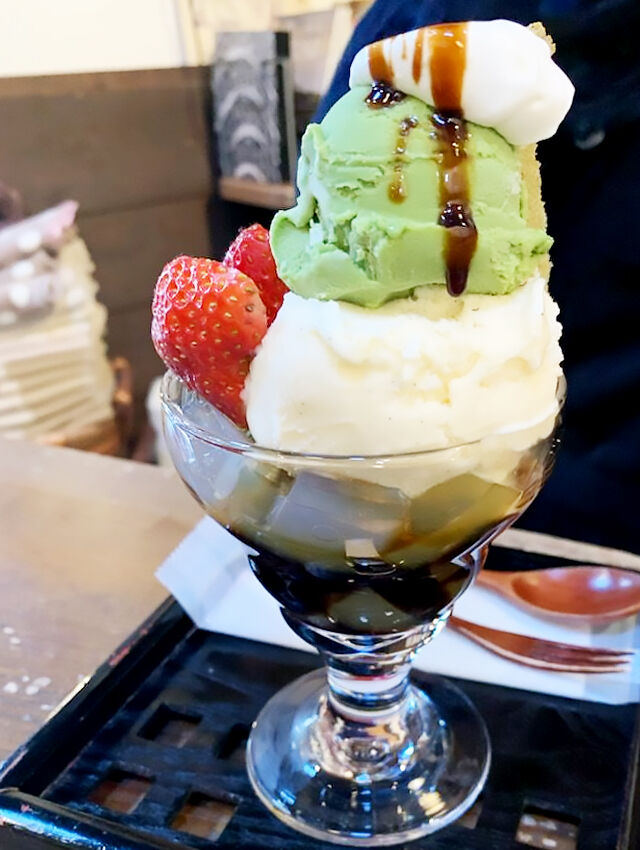
Locate an element on the screen. This screenshot has height=850, width=640. clear glass is located at coordinates (410, 751).